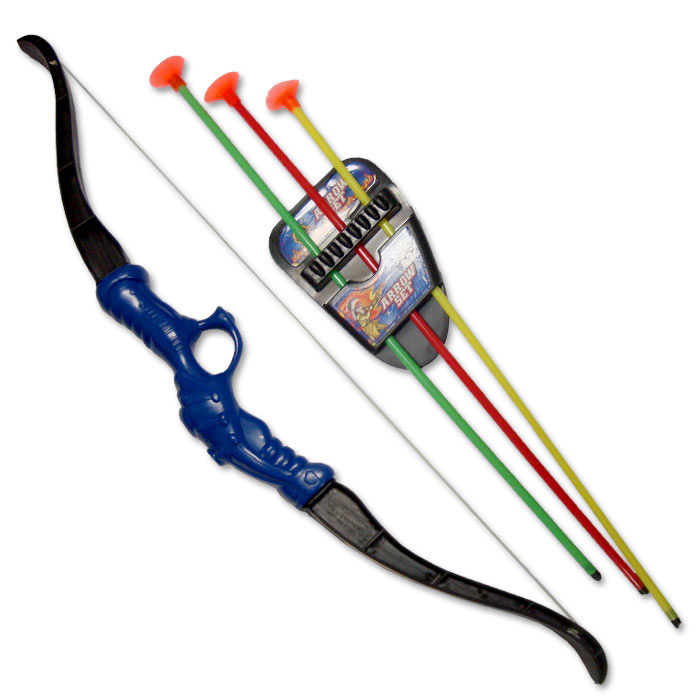
In order to click on toy in this screenshot , I will do `click(377, 435)`.